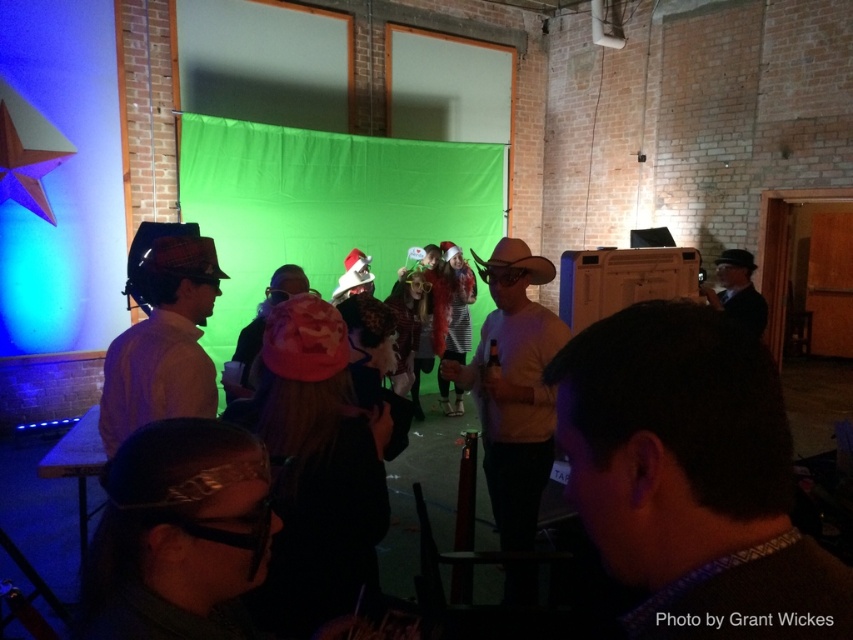
You are at the entrance of the room and want to find the shiny metallic headband at lower left. According to the coordinates provided, where should you look relative to the green screen backdrop?

The shiny metallic headband at lower left is located at point 0.836 on the x axis and 0.210 on the y axis, so you should look towards the right side and lower portion of the image relative to the green screen backdrop.

You are a photographer at the event and need to adjust the lighting so that the shiny metallic headband at lower left and the matte brown hat at left are both visible. Which object should you focus on first to ensure proper exposure?

The shiny metallic headband at lower left is in front of the matte brown hat at left, so you should focus on adjusting the lighting for the shiny metallic headband at lower left first to ensure it doesn

You are at the party and want to take a photo with the brown fuzzy sweater at center and the matte brown hat at left. Which item should you move closer to the camera to ensure both are in focus?

The matte brown hat at left should be moved closer to the camera because the brown fuzzy sweater at center is already closer to the viewer. This will balance their distance for better focus.